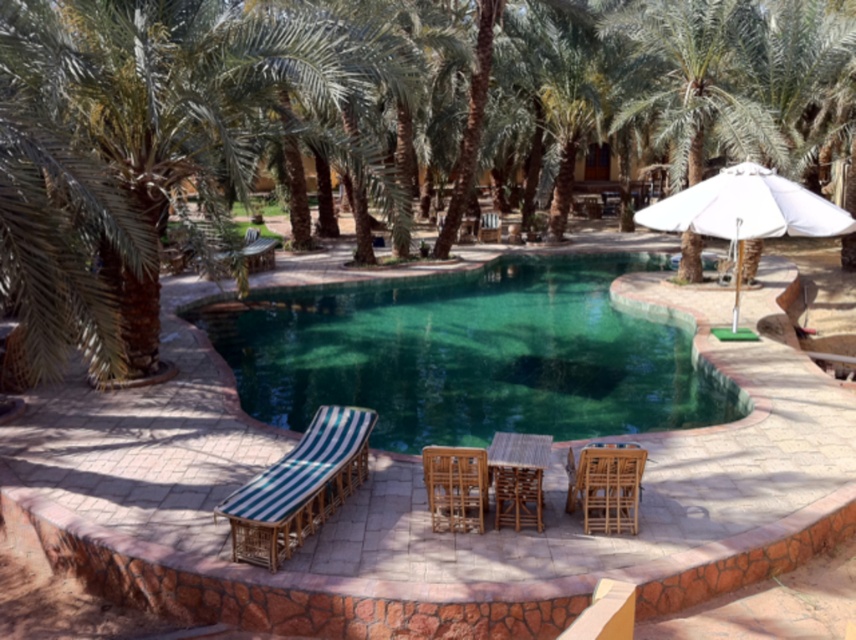
You are planning to place a new potted plant between the green striped fabric at lower left and the brown woven chair at center. Based on their positions, which object should the plant be closer to?

The green striped fabric at lower left is in front of the brown woven chair at center, so the plant should be placed closer to the brown woven chair at center to maintain the spatial arrangement.

You are planning to place a 4.5 meter long bench between the green leafy palm tree at center and the wooden chair at center. Based on the scene description, will the bench fit between them without overlapping either object?

The distance between the green leafy palm tree at center and the wooden chair at center is 4.11 meters. Since the bench is 4.5 meters long, it will not fit between them without overlapping the objects.